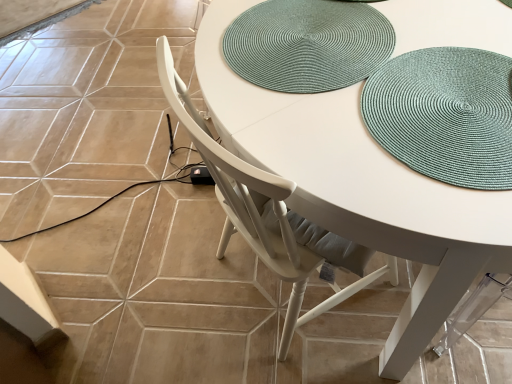
Question: Is white wood chair at center smaller than teal woven placemat at upper center?

Choices:
 (A) yes
 (B) no

Answer: (B)

Question: Is teal woven placemat at upper center inside white wood chair at center?

Choices:
 (A) yes
 (B) no

Answer: (A)

Question: Does white wood chair at center have a larger size compared to teal woven placemat at upper center?

Choices:
 (A) yes
 (B) no

Answer: (A)

Question: Are white wood chair at center and teal woven placemat at upper center far apart?

Choices:
 (A) no
 (B) yes

Answer: (A)

Question: From a real-world perspective, is white wood chair at center below teal woven placemat at upper center?

Choices:
 (A) no
 (B) yes

Answer: (B)

Question: Is teal woven placemat at upper right to the left or to the right of white wood chair at center in the image?

Choices:
 (A) right
 (B) left

Answer: (B)

Question: Is teal woven placemat at upper right wider or thinner than white wood chair at center?

Choices:
 (A) thin
 (B) wide

Answer: (A)

Question: From a real-world perspective, is teal woven placemat at upper right positioned above or below white wood chair at center?

Choices:
 (A) below
 (B) above

Answer: (B)

Question: Is teal woven placemat at upper right inside or outside of white wood chair at center?

Choices:
 (A) inside
 (B) outside

Answer: (A)

Question: In terms of height, does teal woven placemat at upper right look taller or shorter compared to teal woven placemat at upper center?

Choices:
 (A) short
 (B) tall

Answer: (B)

Question: In terms of size, does teal woven placemat at upper right appear bigger or smaller than teal woven placemat at upper center?

Choices:
 (A) small
 (B) big

Answer: (B)

Question: Considering their positions, is teal woven placemat at upper right located in front of or behind teal woven placemat at upper center?

Choices:
 (A) front
 (B) behind

Answer: (A)

Question: In terms of width, does teal woven placemat at upper right look wider or thinner when compared to teal woven placemat at upper center?

Choices:
 (A) thin
 (B) wide

Answer: (B)

Question: From the image's perspective, is teal woven placemat at upper center above or below teal woven placemat at upper right?

Choices:
 (A) above
 (B) below

Answer: (A)

Question: Looking at their shapes, would you say teal woven placemat at upper center is wider or thinner than teal woven placemat at upper right?

Choices:
 (A) thin
 (B) wide

Answer: (A)